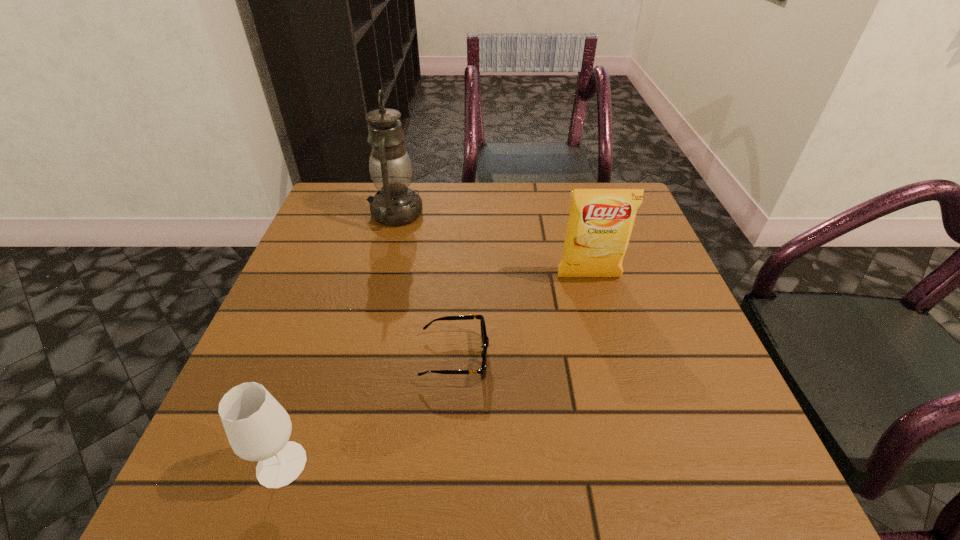
The width and height of the screenshot is (960, 540). What are the coordinates of `vacant space at the near edge of the desktop` in the screenshot? It's located at (610, 447).

Locate an element on the screen. The width and height of the screenshot is (960, 540). vacant space at the left edge of the desktop is located at coordinates (332, 334).

Find the location of `vacant space at the right edge`. vacant space at the right edge is located at coordinates (739, 431).

Locate an element on the screen. free spot at the far left corner of the desktop is located at coordinates (348, 207).

The image size is (960, 540). In the image, there is a desktop. Identify the location of vacant space at the near left corner. (275, 493).

Identify the location of free space between the tallest object and the nearest object. (339, 339).

Identify the location of free space between the oil lamp and the glass. This screenshot has width=960, height=540. (339, 339).

In order to click on free space that is in between the third farthest object and the glass in this screenshot , I will do `click(369, 411)`.

Locate an element on the screen. The width and height of the screenshot is (960, 540). free area in between the tallest object and the sunglasses is located at coordinates (425, 285).

What are the coordinates of `free space between the sunglasses and the rightmost object` in the screenshot? It's located at (522, 317).